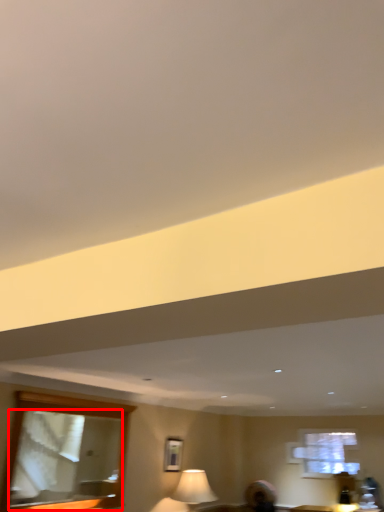
Question: From the image's perspective, where is mirror (annotated by the red box) located in relation to picture frame in the image?

Choices:
 (A) below
 (B) above

Answer: (B)